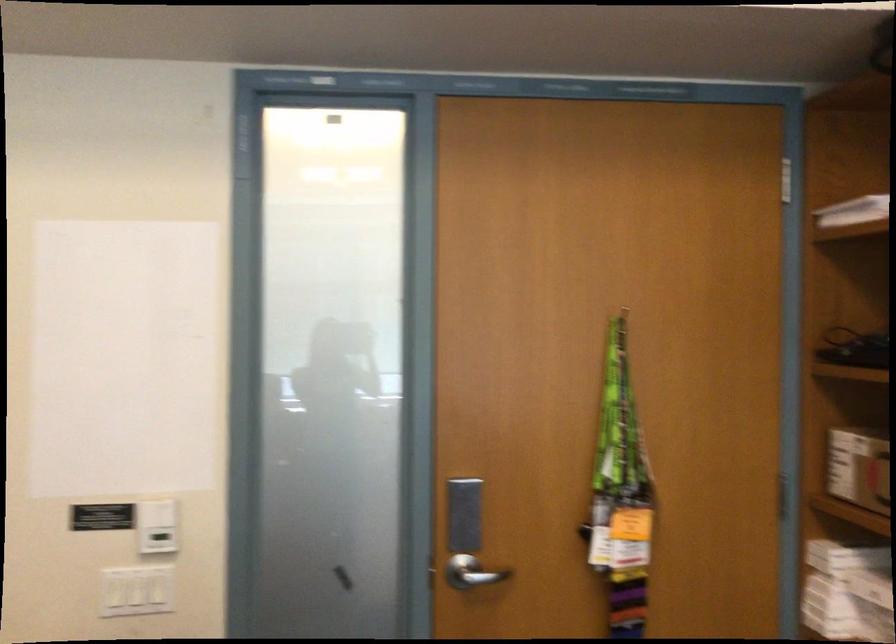
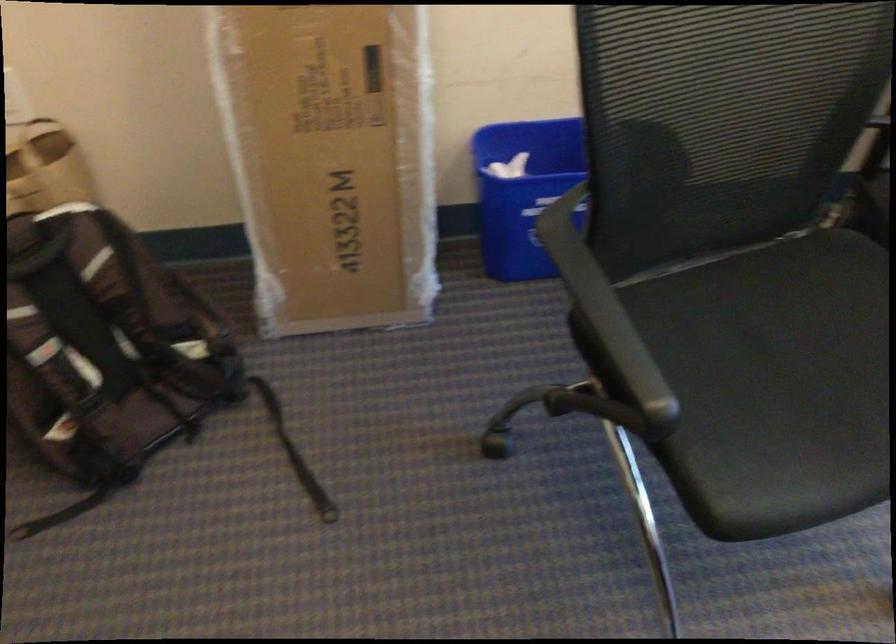
The images are taken continuously from a first-person perspective. In which direction is your viewpoint rotating?

Result: The camera's rotation is toward right-down.